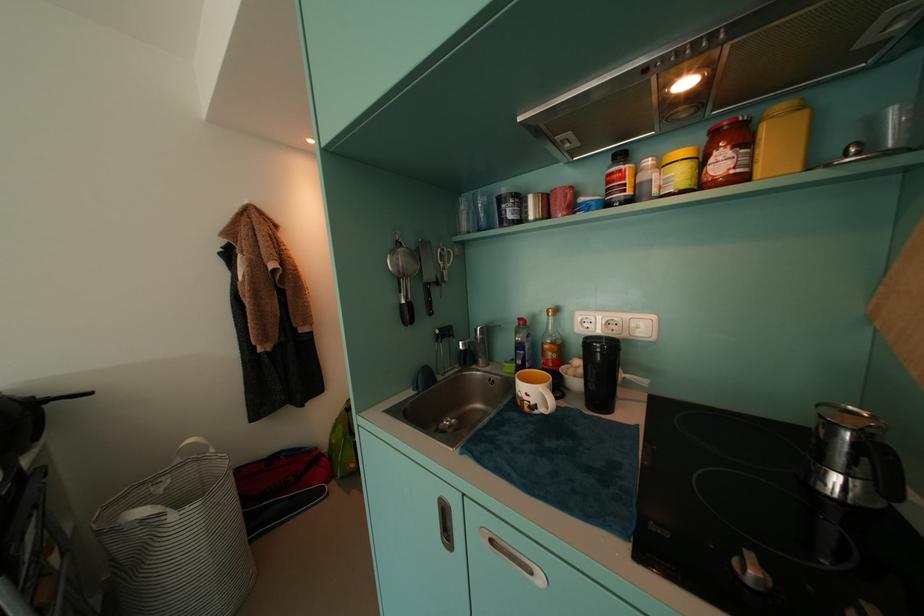
Image resolution: width=924 pixels, height=616 pixels. Identify the location of moka pot handle. click(854, 458).